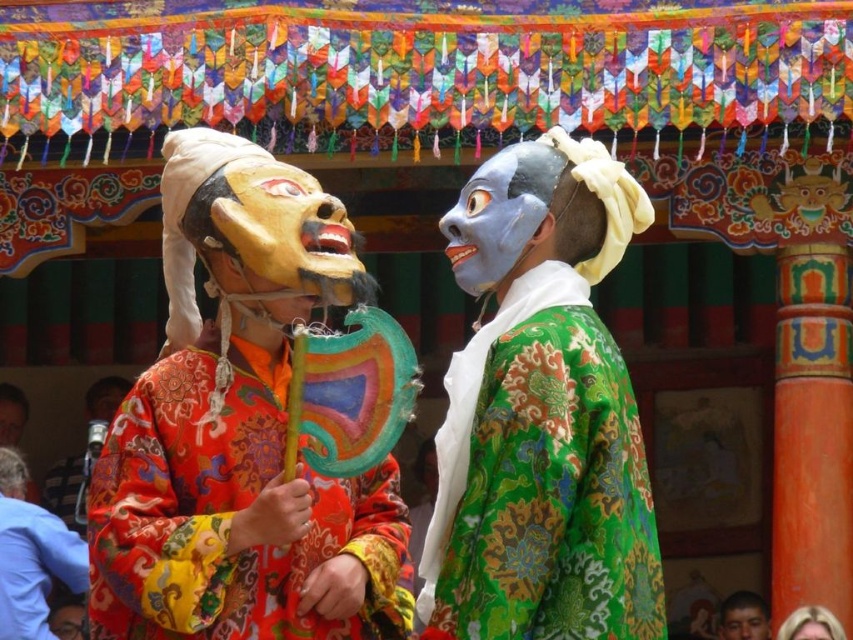
Question: Does matte orange costume at left appear over smooth blonde hair at center?

Choices:
 (A) no
 (B) yes

Answer: (B)

Question: Does matte orange robe at center appear over smooth blonde hair at center?

Choices:
 (A) yes
 (B) no

Answer: (A)

Question: Which object appears closest to the camera in this image?

Choices:
 (A) shiny silk robe at center
 (B) smooth blonde hair at center
 (C) smooth skin face at lower right
 (D) matte orange robe at center

Answer: (A)

Question: Can you confirm if matte yellow mask at center is bigger than matte blue mask at center?

Choices:
 (A) yes
 (B) no

Answer: (B)

Question: Which of the following is the closest to the observer?

Choices:
 (A) matte orange robe at center
 (B) matte painted mask at center

Answer: (B)

Question: Among these points, which one is nearest to the camera?

Choices:
 (A) (496, 186)
 (B) (62, 612)
 (C) (366, 586)
 (D) (737, 625)

Answer: (C)